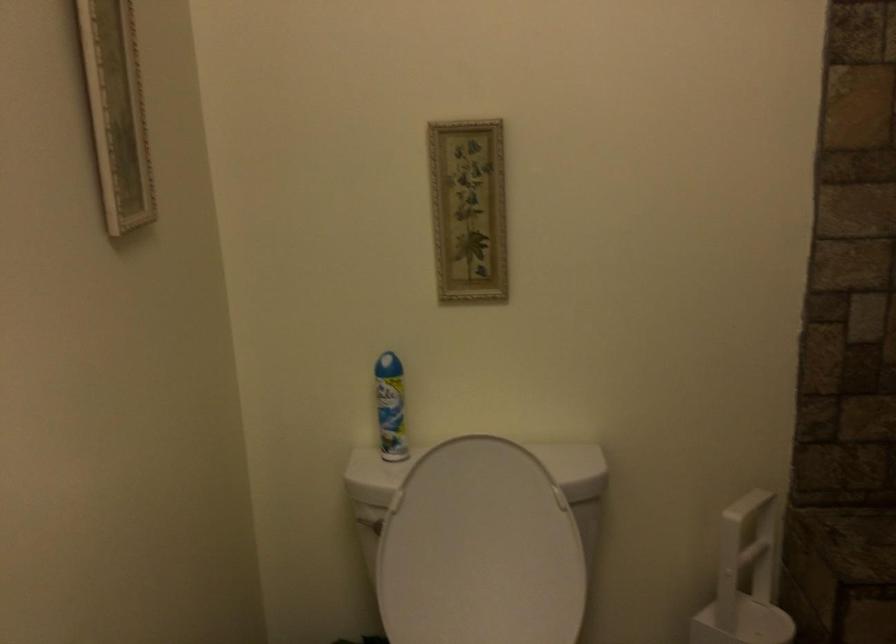
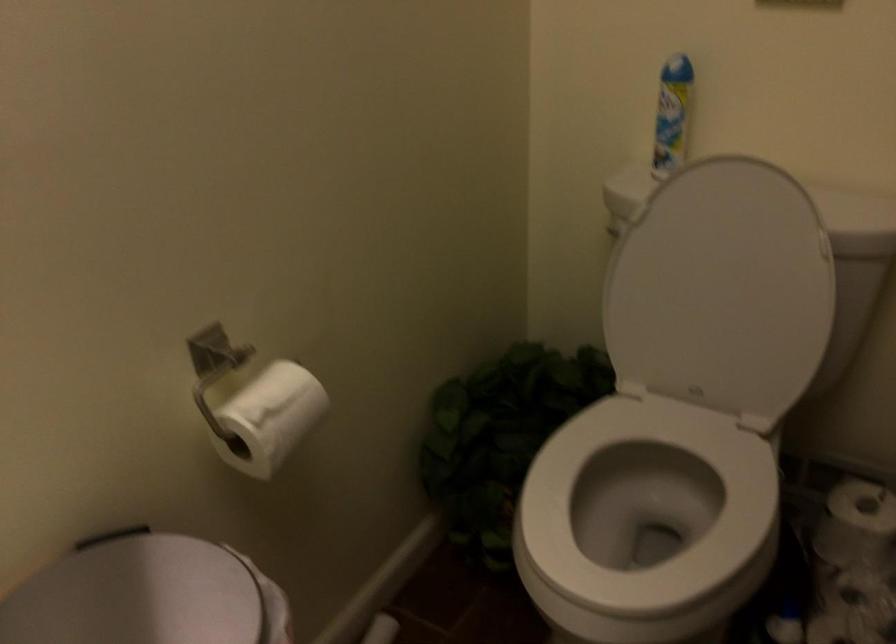
Find the pixel in the second image that matches point 485,556 in the first image.

(721, 289)